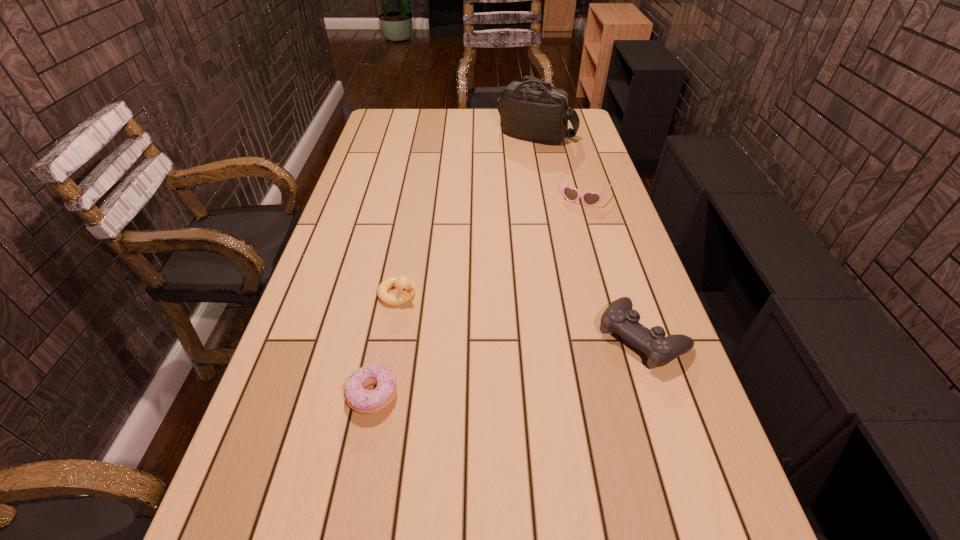
At what (x,y) coordinates should I click in order to perform the action: click on doughnut. Please return your answer as a coordinate pair (x, y). The height and width of the screenshot is (540, 960). Looking at the image, I should click on (364, 401).

Where is `control`? This screenshot has height=540, width=960. control is located at coordinates (619, 317).

Where is `the second farthest object`? This screenshot has height=540, width=960. the second farthest object is located at coordinates (589, 198).

The image size is (960, 540). Identify the location of duckling. (406, 289).

At what (x,y) coordinates should I click in order to perform the action: click on the farthest object. Please return your answer as a coordinate pair (x, y). This screenshot has height=540, width=960. Looking at the image, I should click on (538, 113).

Identify the location of shoulder bag. This screenshot has height=540, width=960. (538, 113).

Locate an element on the screen. This screenshot has height=540, width=960. free space located on the right of the doughnut is located at coordinates (421, 395).

Identify the location of free spot located on the left of the control. The width and height of the screenshot is (960, 540). (548, 336).

Find the location of a particular element. Image resolution: width=960 pixels, height=540 pixels. free point located on the front-facing side of the second farthest object is located at coordinates (566, 232).

The height and width of the screenshot is (540, 960). Find the location of `vacant space located 0.080m on the front-facing side of the second farthest object`. vacant space located 0.080m on the front-facing side of the second farthest object is located at coordinates (571, 221).